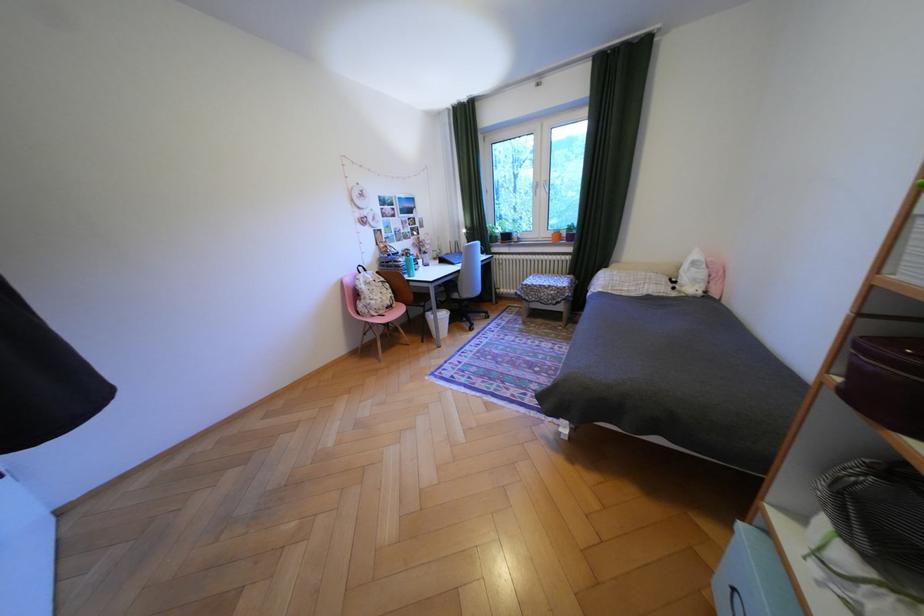
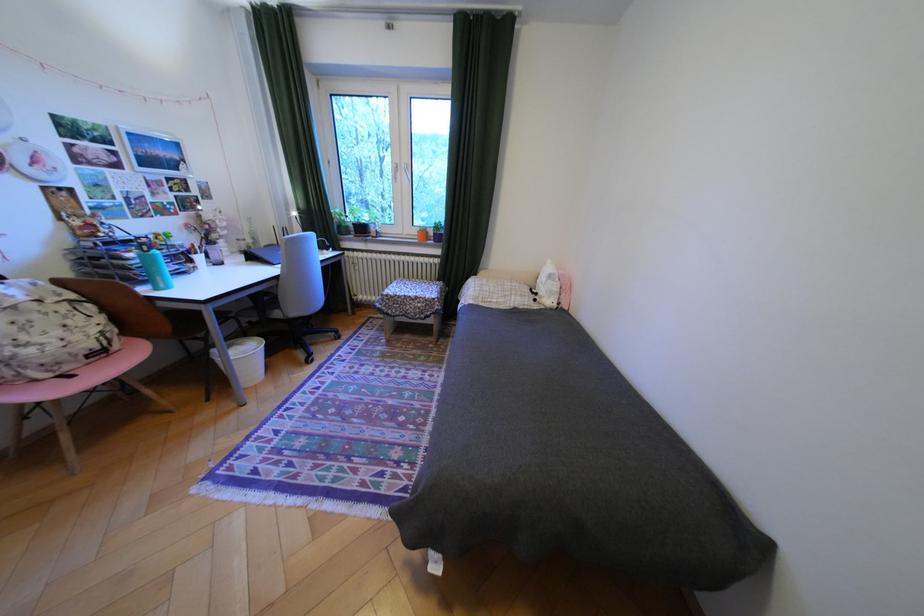
The point at (687, 282) is marked in the first image. Where is the corresponding point in the second image?

(548, 294)